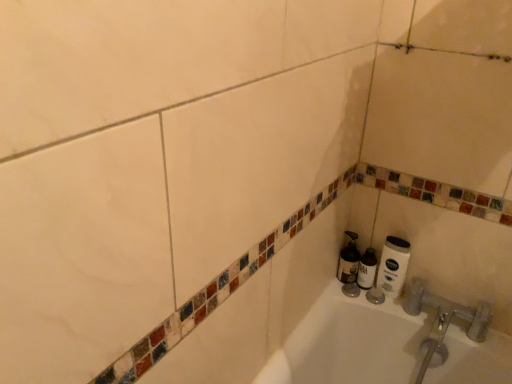
Question: From the image's perspective, is white matte shaving cream at lower right, which is the 2th shaving cream in left-to-right order, under white matte toilet paper at lower right?

Choices:
 (A) yes
 (B) no

Answer: (A)

Question: Does white matte shaving cream at lower right, placed as the first shaving cream when sorted from right to left, appear on the right side of white matte toilet paper at lower right?

Choices:
 (A) yes
 (B) no

Answer: (B)

Question: Does white matte shaving cream at lower right, which is the 2th shaving cream in left-to-right order, have a greater width compared to white matte toilet paper at lower right?

Choices:
 (A) yes
 (B) no

Answer: (A)

Question: Is white matte shaving cream at lower right, placed as the first shaving cream when sorted from right to left, oriented away from white matte toilet paper at lower right?

Choices:
 (A) no
 (B) yes

Answer: (A)

Question: Can you confirm if white matte shaving cream at lower right, placed as the first shaving cream when sorted from right to left, is positioned to the left of white matte toilet paper at lower right?

Choices:
 (A) yes
 (B) no

Answer: (A)

Question: Is white matte shaving cream at lower right, placed as the first shaving cream when sorted from right to left, far away from white matte toilet paper at lower right?

Choices:
 (A) yes
 (B) no

Answer: (B)

Question: From the image's perspective, is white matte toilet paper at lower right on top of white matte shaving cream at lower right, which is the 2th shaving cream in left-to-right order?

Choices:
 (A) no
 (B) yes

Answer: (B)

Question: Does white matte toilet paper at lower right have a greater height compared to white matte shaving cream at lower right, placed as the first shaving cream when sorted from right to left?

Choices:
 (A) yes
 (B) no

Answer: (A)

Question: From the image's perspective, is white matte toilet paper at lower right beneath white matte shaving cream at lower right, placed as the first shaving cream when sorted from right to left?

Choices:
 (A) yes
 (B) no

Answer: (B)

Question: Is there a large distance between white matte toilet paper at lower right and white matte shaving cream at lower right, which is the 2th shaving cream in left-to-right order?

Choices:
 (A) yes
 (B) no

Answer: (B)

Question: Does white matte toilet paper at lower right have a lesser height compared to white matte shaving cream at lower right, placed as the first shaving cream when sorted from right to left?

Choices:
 (A) no
 (B) yes

Answer: (A)

Question: Considering the relative positions of white matte toilet paper at lower right and white matte shaving cream at lower right, which is the 2th shaving cream in left-to-right order, in the image provided, is white matte toilet paper at lower right in front of white matte shaving cream at lower right, which is the 2th shaving cream in left-to-right order,?

Choices:
 (A) no
 (B) yes

Answer: (B)

Question: Considering the relative positions of white matte shaving cream at lower right, the 2th shaving cream from the right, and white matte toilet paper at lower right in the image provided, is white matte shaving cream at lower right, the 2th shaving cream from the right, behind white matte toilet paper at lower right?

Choices:
 (A) yes
 (B) no

Answer: (A)